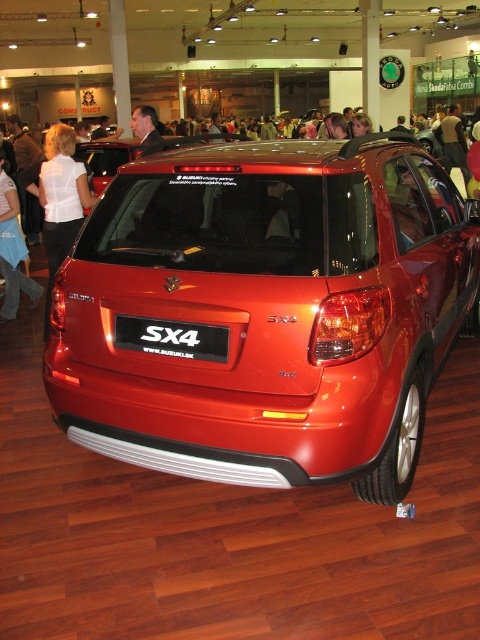
Can you confirm if glossy metallic suv at center is bigger than dark suit jacket at upper center?

Incorrect, glossy metallic suv at center is not larger than dark suit jacket at upper center.

Between point (399, 300) and point (145, 141), which one is positioned in front?

Positioned in front is point (399, 300).

Find the location of a particular element. glossy metallic suv at center is located at coordinates (267, 310).

How distant is white plastic license plate at center from matte black jacket at upper center?

white plastic license plate at center is 15.93 meters from matte black jacket at upper center.

Who is taller, white plastic license plate at center or matte black jacket at upper center?

matte black jacket at upper center

Which is behind, point (187, 330) or point (437, 131)?

The point (437, 131) is behind.

Image resolution: width=480 pixels, height=640 pixels. I want to click on white plastic license plate at center, so click(x=171, y=337).

Is point (1, 173) in front of point (139, 116)?

No, it is behind (139, 116).

Between white fabric shirt at upper left and dark suit jacket at upper center, which one is positioned higher?

dark suit jacket at upper center is higher up.

Which is behind, point (13, 296) or point (136, 131)?

Positioned behind is point (13, 296).

Identify the location of white fabric shirt at upper left. The width and height of the screenshot is (480, 640). (12, 250).